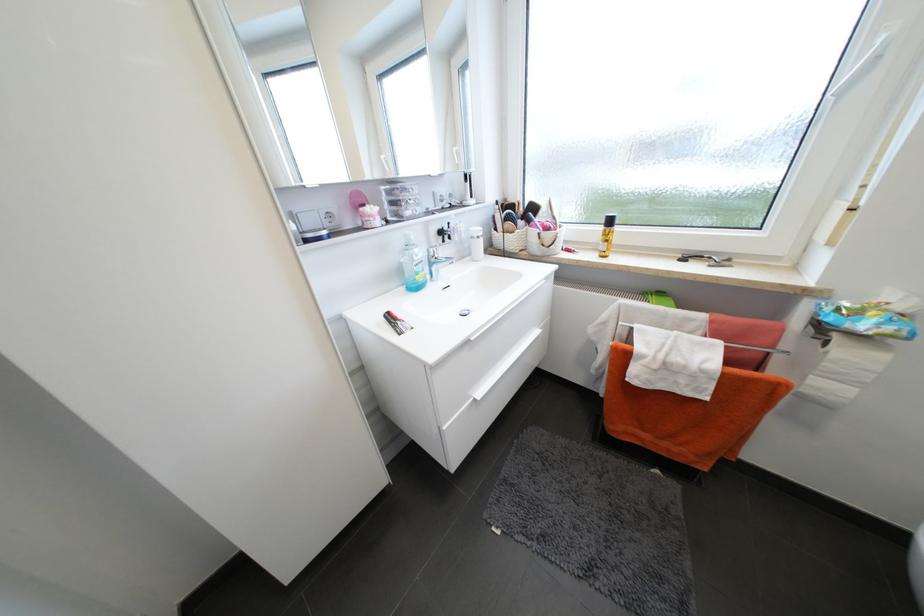
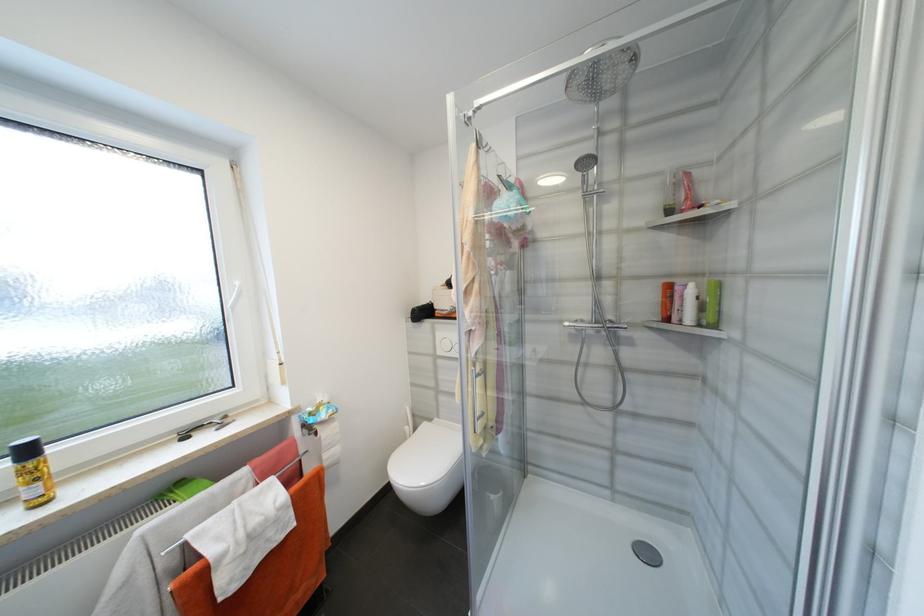
In the second image, find the point that corresponds to (728,264) in the first image.

(228, 422)